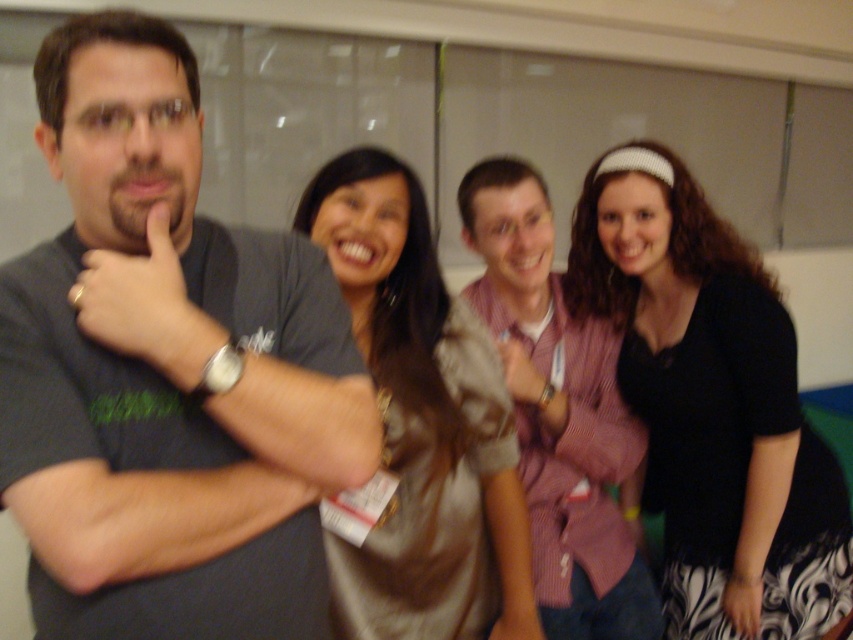
Question: Is silky beige blouse at center bigger than black fabric at right?

Choices:
 (A) no
 (B) yes

Answer: (B)

Question: Among these points, which one is farthest from the camera?

Choices:
 (A) (543, 572)
 (B) (61, 576)
 (C) (821, 440)

Answer: (C)

Question: Which object is the farthest from the black knit sweater at center?

Choices:
 (A) pink striped shirt at center
 (B) black fabric at right
 (C) gray matte t-shirt at center

Answer: (C)

Question: Which point is farther to the camera?

Choices:
 (A) (61, 584)
 (B) (650, 337)
 (C) (529, 461)

Answer: (B)

Question: Is black knit sweater at center positioned before silky beige blouse at center?

Choices:
 (A) yes
 (B) no

Answer: (B)

Question: Is pink striped shirt at center thinner than black fabric at right?

Choices:
 (A) yes
 (B) no

Answer: (B)